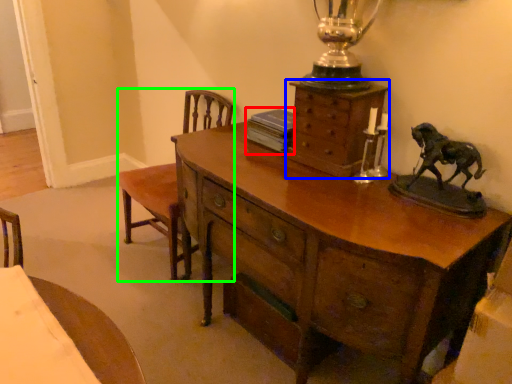
Question: Estimate the real-world distances between objects in this image. Which object is farther from book (highlighted by a red box), chest of drawers (highlighted by a blue box) or armchair (highlighted by a green box)?

Choices:
 (A) chest of drawers
 (B) armchair

Answer: (B)